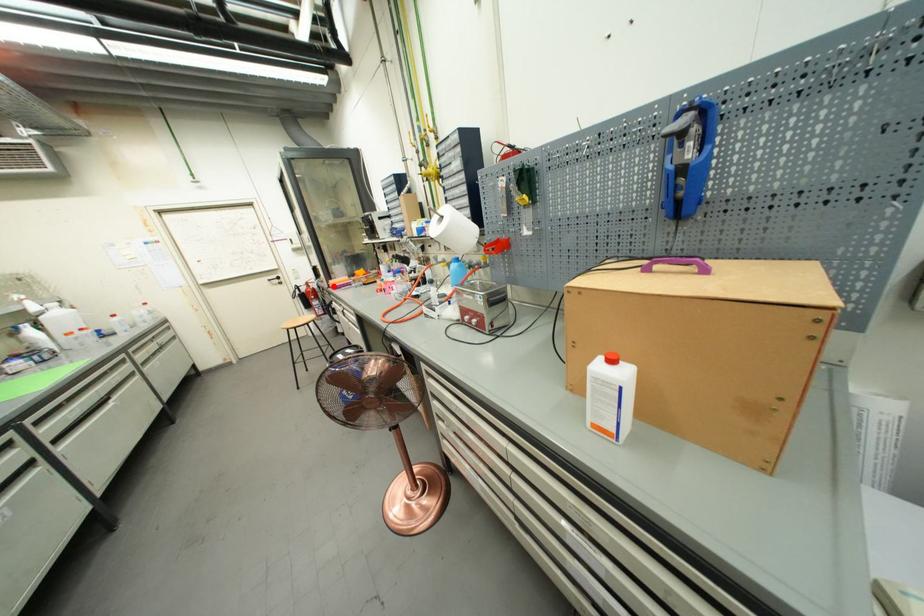
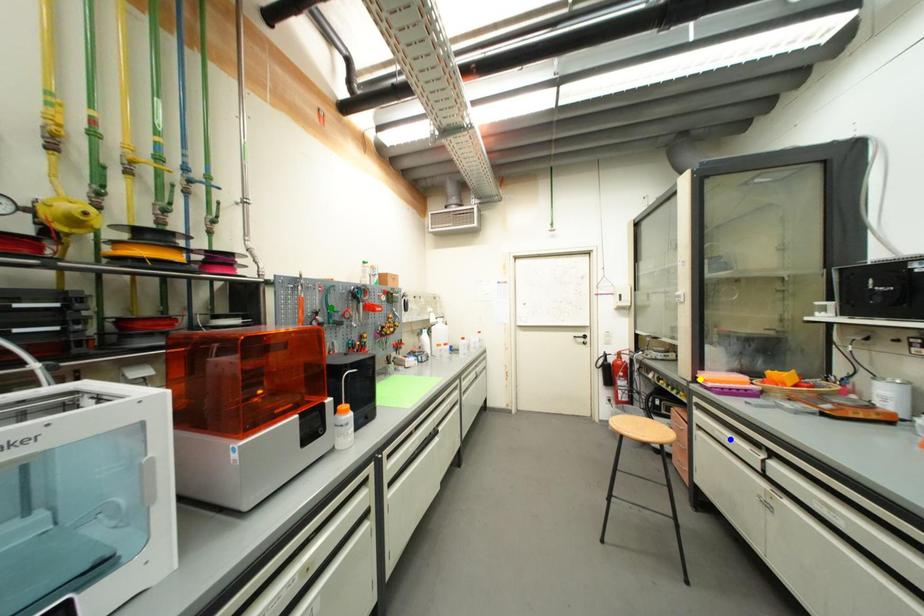
Question: I am providing you with two images of the same scene from different viewpoints. A red point is marked on the first image. You are given multiple points on the second image. In image 2, which mark is for the same physical point as the one in image 1?

Choices:
 (A) yellow point
 (B) green point
 (C) blue point

Answer: (A)